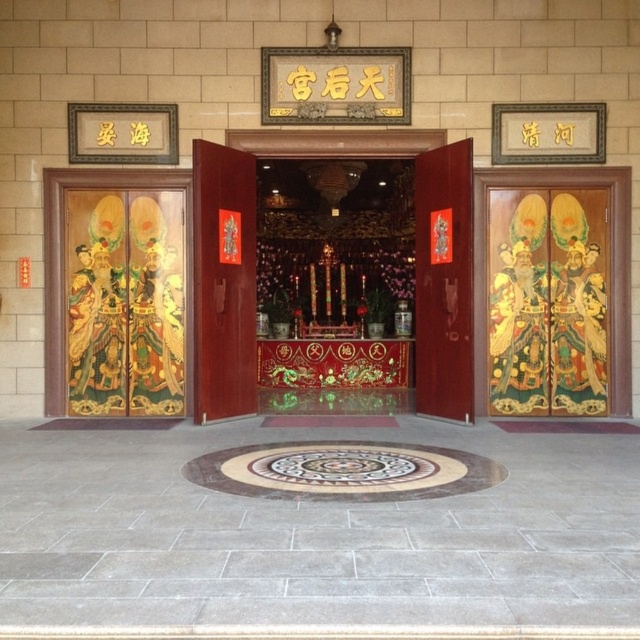
Question: Does polished wood doors at center have a lesser width compared to matte wooden door at center?

Choices:
 (A) no
 (B) yes

Answer: (B)

Question: Is polished wood doors at center wider than matte wooden door at center?

Choices:
 (A) no
 (B) yes

Answer: (A)

Question: Which object is the farthest from the polished wood doors at center?

Choices:
 (A) matte wooden door at center
 (B) matte wood door at center

Answer: (A)

Question: Which point is closer to the camera taking this photo?

Choices:
 (A) (240, 237)
 (B) (467, 278)
 (C) (464, 289)

Answer: (B)

Question: Considering the real-world distances, which object is farthest from the matte wooden door at center?

Choices:
 (A) polished wood doors at center
 (B) matte wood door at center

Answer: (A)

Question: Is polished wood doors at center in front of matte wooden door at center?

Choices:
 (A) no
 (B) yes

Answer: (B)